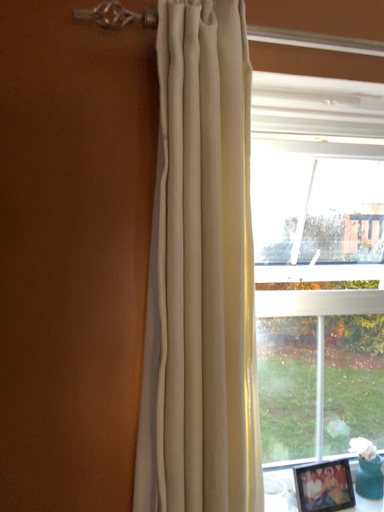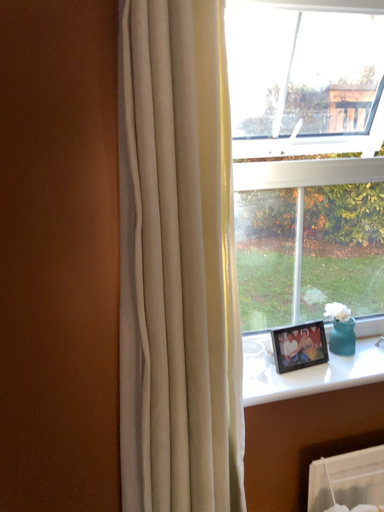
Question: Which way did the camera rotate in the video?

Choices:
 (A) rotated downward
 (B) rotated upward

Answer: (A)